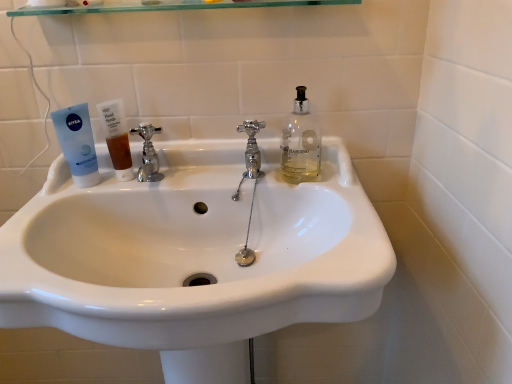
At what (x,y) coordinates should I click in order to perform the action: click on chrome/metallic faucet at center, the first tap in the right-to-left sequence. Please return your answer as a coordinate pair (x, y). Looking at the image, I should click on (252, 147).

Identify the location of chrome metallic faucet at center left, placed as the second tap when sorted from right to left. (148, 154).

This screenshot has height=384, width=512. Describe the element at coordinates (148, 154) in the screenshot. I see `chrome metallic faucet at center left, placed as the second tap when sorted from right to left` at that location.

The width and height of the screenshot is (512, 384). I want to click on translucent amber liquid at sink left, so click(120, 151).

Relative to white glossy sink at center, is transparent glass shelf at upper center in front or behind?

Clearly, transparent glass shelf at upper center is behind white glossy sink at center.

From a real-world perspective, which is physically above, transparent glass shelf at upper center or white glossy sink at center?

transparent glass shelf at upper center, from a real-world perspective.

Is transparent glass shelf at upper center placed right next to white glossy sink at center?

No.

Who is bigger, translucent amber liquid at sink left or blue matte tube at left?

Bigger between the two is blue matte tube at left.

Is point (122, 162) closer or farther from the camera than point (79, 148)?

Point (122, 162) is farther from the camera than point (79, 148).

From a real-world perspective, is translucent amber liquid at sink left on blue matte tube at left?

No, from a real-world perspective, translucent amber liquid at sink left is not over blue matte tube at left

Locate an element on the screen. The width and height of the screenshot is (512, 384). liquid on the right of blue matte tube at left is located at coordinates (120, 151).

Does point (145, 171) appear closer or farther from the camera than point (243, 123)?

Clearly, point (145, 171) is closer to the camera than point (243, 123).

Is chrome metallic faucet at center left, the first tap positioned from the left, located outside chrome/metallic faucet at center, the first tap in the right-to-left sequence?

chrome metallic faucet at center left, the first tap positioned from the left, is positioned outside chrome/metallic faucet at center, the first tap in the right-to-left sequence.

Is chrome metallic faucet at center left, placed as the second tap when sorted from right to left, oriented away from chrome/metallic faucet at center, the second tap when ordered from left to right?

No, chrome/metallic faucet at center, the second tap when ordered from left to right, is not at the back of chrome metallic faucet at center left, placed as the second tap when sorted from right to left.

Who is bigger, chrome metallic faucet at center left, the first tap positioned from the left, or chrome/metallic faucet at center, the first tap in the right-to-left sequence?

With larger size is chrome metallic faucet at center left, the first tap positioned from the left.

Is chrome/metallic faucet at center, the first tap in the right-to-left sequence, completely or partially outside of translucent amber liquid at sink left?

chrome/metallic faucet at center, the first tap in the right-to-left sequence, is positioned outside translucent amber liquid at sink left.

From a real-world perspective, is chrome/metallic faucet at center, the first tap in the right-to-left sequence, positioned under translucent amber liquid at sink left based on gravity?

No, from a real-world perspective, chrome/metallic faucet at center, the first tap in the right-to-left sequence, is not under translucent amber liquid at sink left.

Where is `the 2nd tap above when counting from the translucent amber liquid at sink left (from the image's perspective)`? the 2nd tap above when counting from the translucent amber liquid at sink left (from the image's perspective) is located at coordinates pos(252,147).

Which point is more distant from viewer, (252,126) or (112,140)?

Point (252,126)

Does white glossy sink at center turn towards blue matte tube at left?

No, white glossy sink at center is not aimed at blue matte tube at left.

Considering the relative positions of white glossy sink at center and blue matte tube at left in the image provided, is white glossy sink at center in front of blue matte tube at left?

Yes, white glossy sink at center is in front of blue matte tube at left.

Is point (262, 283) positioned behind point (65, 114)?

No, (262, 283) is closer to viewer.

Would you say white glossy sink at center is a long distance from blue matte tube at left?

No, white glossy sink at center is not far away from blue matte tube at left.

Is transparent glass shelf at upper center looking in the opposite direction of chrome/metallic faucet at center, the second tap when ordered from left to right?

No.

Is transparent glass shelf at upper center not near chrome/metallic faucet at center, the second tap when ordered from left to right?

That's not correct — transparent glass shelf at upper center is a little close to chrome/metallic faucet at center, the second tap when ordered from left to right.

Is transparent glass shelf at upper center positioned before chrome/metallic faucet at center, the second tap when ordered from left to right?

Yes, it is.

Could you measure the distance between transparent glass shelf at upper center and chrome/metallic faucet at center, the first tap in the right-to-left sequence?

transparent glass shelf at upper center is 10.97 inches away from chrome/metallic faucet at center, the first tap in the right-to-left sequence.

From the image's perspective, is translucent amber liquid at sink left above or below white glossy sink at center?

Clearly, from the image's perspective, translucent amber liquid at sink left is above white glossy sink at center.

Measure the distance from translucent amber liquid at sink left to white glossy sink at center.

translucent amber liquid at sink left and white glossy sink at center are 10.96 inches apart.

Are translucent amber liquid at sink left and white glossy sink at center far apart?

No, translucent amber liquid at sink left is not far away from white glossy sink at center.

Can you confirm if translucent amber liquid at sink left is smaller than white glossy sink at center?

Correct, translucent amber liquid at sink left occupies less space than white glossy sink at center.

At what (x,y) coordinates should I click in order to perform the action: click on sink on the left of transparent glass shelf at upper center. Please return your answer as a coordinate pair (x, y). Looking at the image, I should click on click(194, 255).

You are a GUI agent. You are given a task and a screenshot of the screen. Output one action in this format:
    pyautogui.click(x=<x>, y=<y>)
    Task: Click on the toothpaste above the translucent amber liquid at sink left (from a real-world perspective)
    
    Given the screenshot: What is the action you would take?
    pyautogui.click(x=77, y=144)

From the image, which object appears to be nearer to translucent amber liquid at sink left, chrome/metallic faucet at center, the first tap in the right-to-left sequence, or transparent glass shelf at upper center?

chrome/metallic faucet at center, the first tap in the right-to-left sequence, is closer to translucent amber liquid at sink left.

When comparing their distances from transparent glass shelf at upper center, does translucent amber liquid at sink left or blue matte tube at left seem closer?

blue matte tube at left is positioned closer to the anchor transparent glass shelf at upper center.

Based on their spatial positions, is chrome/metallic faucet at center, the first tap in the right-to-left sequence, or chrome metallic faucet at center left, the first tap positioned from the left, further from blue matte tube at left?

The object further to blue matte tube at left is chrome/metallic faucet at center, the first tap in the right-to-left sequence.

Considering their positions, is chrome/metallic faucet at center, the second tap when ordered from left to right, positioned further to white glossy sink at center than blue matte tube at left?

blue matte tube at left.

Looking at the image, which one is located closer to blue matte tube at left, transparent glass shelf at upper center or translucent amber liquid at sink left?

translucent amber liquid at sink left.

From the picture: Based on their spatial positions, is transparent glass shelf at upper center or blue matte tube at left further from translucent amber liquid at sink left?

transparent glass shelf at upper center is positioned further to the anchor translucent amber liquid at sink left.

From the image, which object appears to be nearer to translucent amber liquid at sink left, white glossy sink at center or blue matte tube at left?

The object closer to translucent amber liquid at sink left is blue matte tube at left.

Which object lies nearer to the anchor point translucent amber liquid at sink left, blue matte tube at left or white glossy sink at center?

blue matte tube at left.

This screenshot has width=512, height=384. What are the coordinates of `liquid located between blue matte tube at left and chrome metallic faucet at center left, placed as the second tap when sorted from right to left, in the left-right direction` in the screenshot? It's located at (120, 151).

Find the location of a particular element. liquid between blue matte tube at left and chrome/metallic faucet at center, the first tap in the right-to-left sequence, in the horizontal direction is located at coordinates (120, 151).

The height and width of the screenshot is (384, 512). Find the location of `tap between blue matte tube at left and chrome/metallic faucet at center, the first tap in the right-to-left sequence, in the horizontal direction`. tap between blue matte tube at left and chrome/metallic faucet at center, the first tap in the right-to-left sequence, in the horizontal direction is located at coordinates (148, 154).

Where is `liquid between transparent glass shelf at upper center and white glossy sink at center in the vertical direction`? Image resolution: width=512 pixels, height=384 pixels. liquid between transparent glass shelf at upper center and white glossy sink at center in the vertical direction is located at coordinates (120, 151).